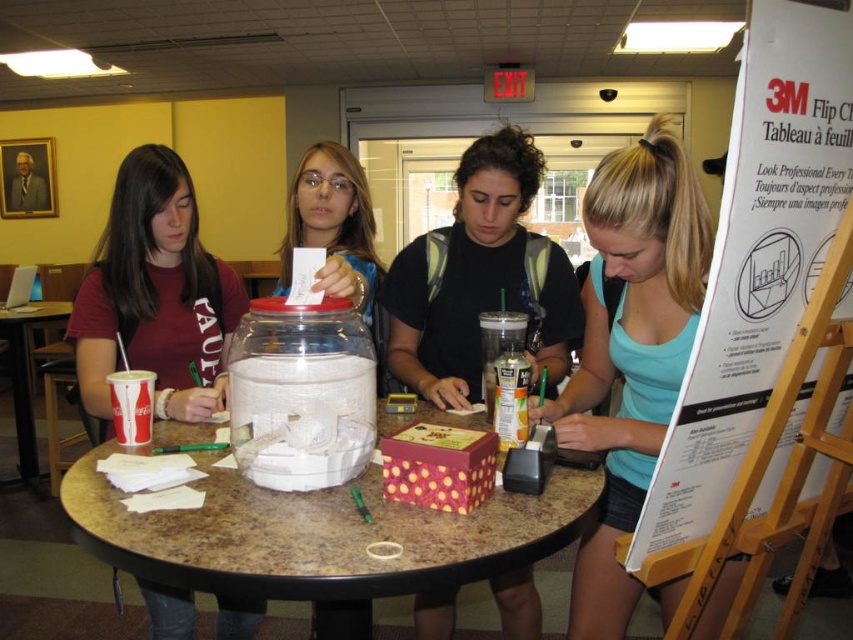
You are a photographer standing in the scene. You want to take a photo of the matte red shirt at left and the brown wood table at lower left. Which object should you focus on first if you want to capture both in a single frame without moving the camera?

The matte red shirt at left is shorter than the brown wood table at lower left, so you should focus on the matte red shirt at left first to ensure both are in focus since it is closer to the camera.